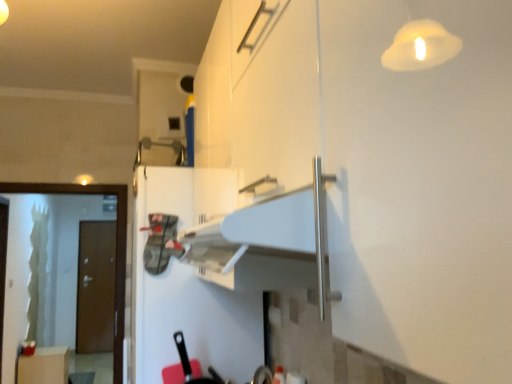
Where is `vacant area on top of green frosted glass screen door at left (from a real-world perspective)`? The image size is (512, 384). vacant area on top of green frosted glass screen door at left (from a real-world perspective) is located at coordinates (54, 177).